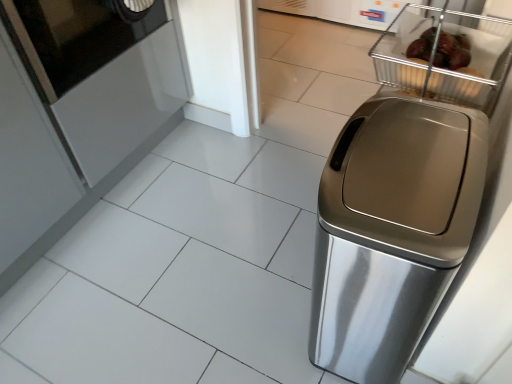
What are the coordinates of `satin silver trash can at right` in the screenshot? It's located at (403, 197).

You are a GUI agent. You are given a task and a screenshot of the screen. Output one action in this format:
    pyautogui.click(x=<x>, y=<y>)
    Task: Click on the metallic wire basket at upper right
    
    Given the screenshot: What is the action you would take?
    pyautogui.click(x=445, y=68)

What do you see at coordinates (445, 68) in the screenshot? I see `metallic wire basket at upper right` at bounding box center [445, 68].

What are the coordinates of `black glass screen door at upper left` in the screenshot? It's located at (75, 36).

Does metallic wire basket at upper right lie in front of satin silver trash can at right?

No.

From a real-world perspective, is metallic wire basket at upper right below satin silver trash can at right?

No.

Considering the sizes of objects metallic wire basket at upper right and black glass screen door at upper left in the image provided, who is taller, metallic wire basket at upper right or black glass screen door at upper left?

With more height is black glass screen door at upper left.

Does metallic wire basket at upper right contain black glass screen door at upper left?

No, black glass screen door at upper left is not a part of metallic wire basket at upper right.

From the image's perspective, between metallic wire basket at upper right and black glass screen door at upper left, which one is located above?

black glass screen door at upper left is shown above in the image.

Between metallic wire basket at upper right and black glass screen door at upper left, which one has larger width?

Wider between the two is black glass screen door at upper left.

Is black glass screen door at upper left taller or shorter than metallic wire basket at upper right?

black glass screen door at upper left is taller than metallic wire basket at upper right.

Would you say black glass screen door at upper left is to the left or to the right of metallic wire basket at upper right in the picture?

Based on their positions, black glass screen door at upper left is located to the left of metallic wire basket at upper right.

From the image's perspective, is black glass screen door at upper left positioned above or below metallic wire basket at upper right?

Clearly, from the image's perspective, black glass screen door at upper left is above metallic wire basket at upper right.

Measure the distance from satin silver trash can at right to metallic wire basket at upper right.

satin silver trash can at right and metallic wire basket at upper right are 19.53 centimeters apart from each other.

In terms of width, does satin silver trash can at right look wider or thinner when compared to metallic wire basket at upper right?

satin silver trash can at right is wider than metallic wire basket at upper right.

Considering the relative sizes of satin silver trash can at right and metallic wire basket at upper right in the image provided, is satin silver trash can at right bigger than metallic wire basket at upper right?

Correct, satin silver trash can at right is larger in size than metallic wire basket at upper right.

Where is `basket on the right of satin silver trash can at right`? basket on the right of satin silver trash can at right is located at coordinates (445, 68).

From the image's perspective, is black glass screen door at upper left below satin silver trash can at right?

Actually, black glass screen door at upper left appears above satin silver trash can at right in the image.

Can you confirm if black glass screen door at upper left is bigger than satin silver trash can at right?

Yes.

Looking at this image, can you confirm if black glass screen door at upper left is positioned to the left of satin silver trash can at right?

Yes, black glass screen door at upper left is to the left of satin silver trash can at right.

Is satin silver trash can at right completely or partially inside black glass screen door at upper left?

No.

Is satin silver trash can at right completely or partially outside of black glass screen door at upper left?

Yes, satin silver trash can at right is not within black glass screen door at upper left.

Is satin silver trash can at right oriented away from black glass screen door at upper left?

No.

Considering the positions of objects satin silver trash can at right and black glass screen door at upper left in the image provided, who is more to the left, satin silver trash can at right or black glass screen door at upper left?

From the viewer's perspective, black glass screen door at upper left appears more on the left side.

From a real-world perspective, which object rests below the other?

satin silver trash can at right is physically lower.

Identify the location of basket located behind the satin silver trash can at right. (445, 68).

Where is `basket in front of the black glass screen door at upper left`? basket in front of the black glass screen door at upper left is located at coordinates (445, 68).

From the image, which object appears to be farther from metallic wire basket at upper right, satin silver trash can at right or black glass screen door at upper left?

black glass screen door at upper left is positioned further to the anchor metallic wire basket at upper right.

When comparing their distances from satin silver trash can at right, does black glass screen door at upper left or metallic wire basket at upper right seem further?

The object further to satin silver trash can at right is black glass screen door at upper left.

In the scene shown: From the image, which object appears to be farther from black glass screen door at upper left, satin silver trash can at right or metallic wire basket at upper right?

satin silver trash can at right lies further to black glass screen door at upper left than the other object.

Based on their spatial positions, is black glass screen door at upper left or satin silver trash can at right further from metallic wire basket at upper right?

Among the two, black glass screen door at upper left is located further to metallic wire basket at upper right.

Consider the image. Estimate the real-world distances between objects in this image. Which object is further from black glass screen door at upper left, metallic wire basket at upper right or satin silver trash can at right?

satin silver trash can at right is further to black glass screen door at upper left.

When comparing their distances from satin silver trash can at right, does metallic wire basket at upper right or black glass screen door at upper left seem further?

The object further to satin silver trash can at right is black glass screen door at upper left.

Image resolution: width=512 pixels, height=384 pixels. I want to click on home appliance between black glass screen door at upper left and metallic wire basket at upper right in the horizontal direction, so click(403, 197).